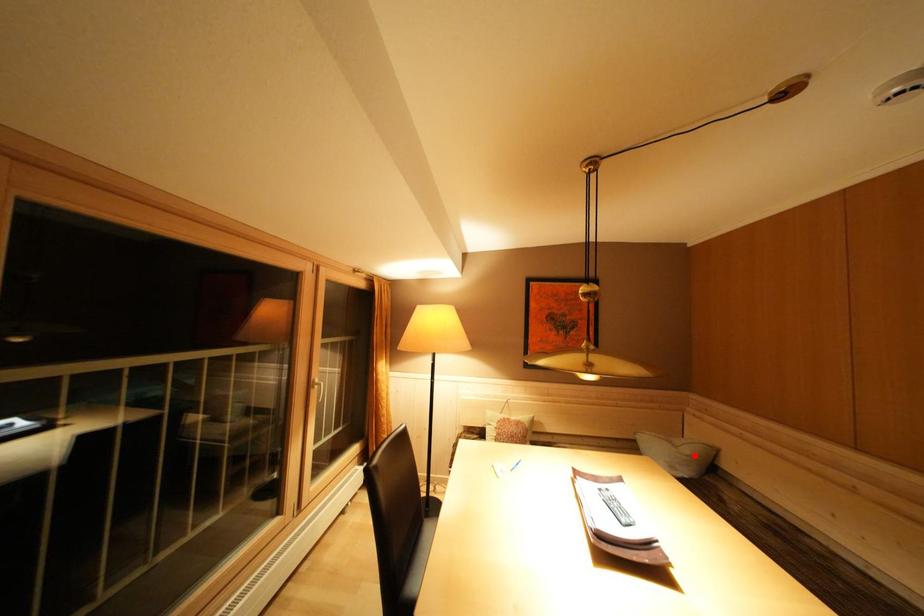
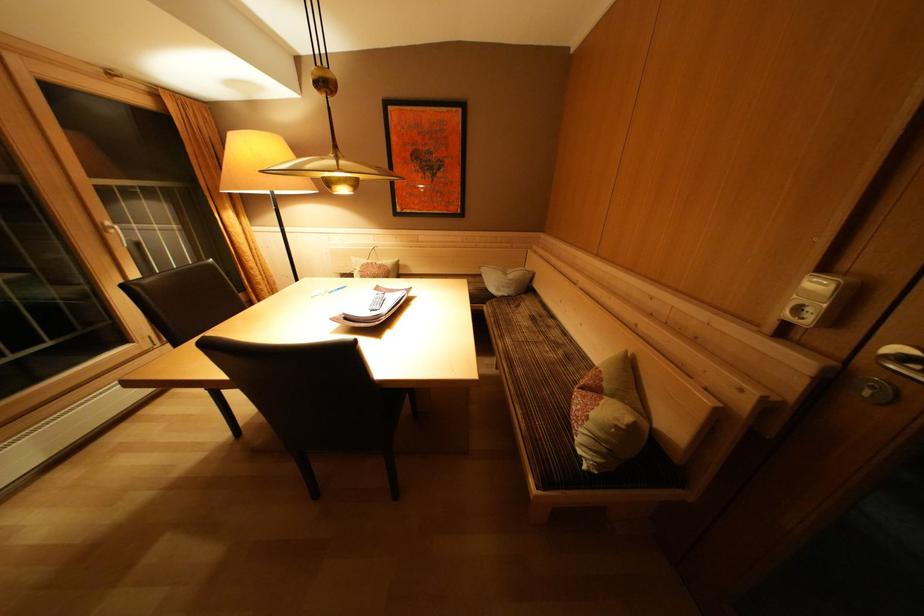
Locate, in the second image, the point that corresponds to the highlighted location in the first image.

(517, 281)